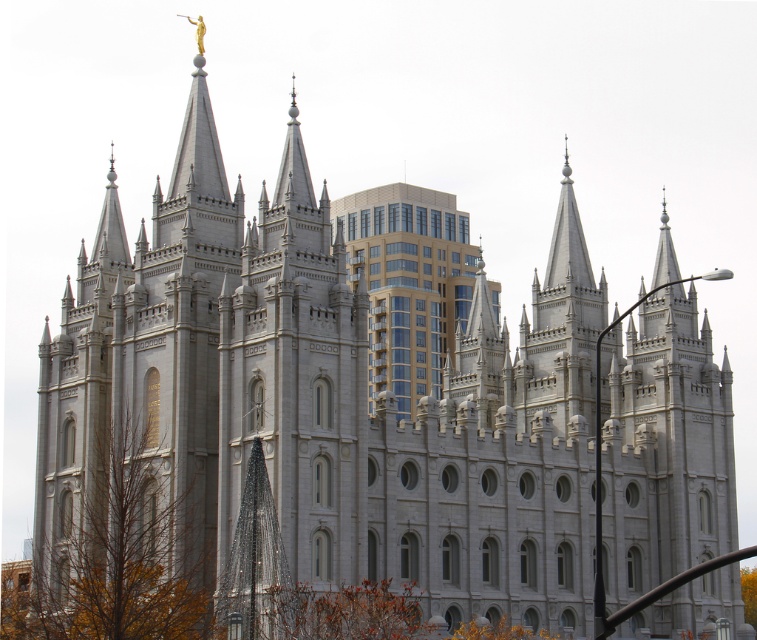
In the scene shown: Does brown leafy tree at lower left come behind golden-brown foliage at lower center?

No, brown leafy tree at lower left is closer to the viewer.

Can you confirm if brown leafy tree at lower left is shorter than golden-brown foliage at lower center?

In fact, brown leafy tree at lower left may be taller than golden-brown foliage at lower center.

Between point (129, 602) and point (469, 627), which one is positioned behind?

The point (469, 627) is behind.

What are the coordinates of `brown leafy tree at lower left` in the screenshot? It's located at (117, 557).

The image size is (757, 640). What do you see at coordinates (117, 557) in the screenshot?
I see `brown leafy tree at lower left` at bounding box center [117, 557].

Which is behind, point (182, 529) or point (332, 634)?

The point (182, 529) is more distant.

Where is `brown leafy tree at lower left`? Image resolution: width=757 pixels, height=640 pixels. brown leafy tree at lower left is located at coordinates (117, 557).

Can you confirm if brown leafy tree at lower center is positioned above green leafy tree at lower right?

Yes.

Is brown leafy tree at lower center smaller than green leafy tree at lower right?

Correct, brown leafy tree at lower center occupies less space than green leafy tree at lower right.

Identify the location of brown leafy tree at lower center. This screenshot has width=757, height=640. (343, 612).